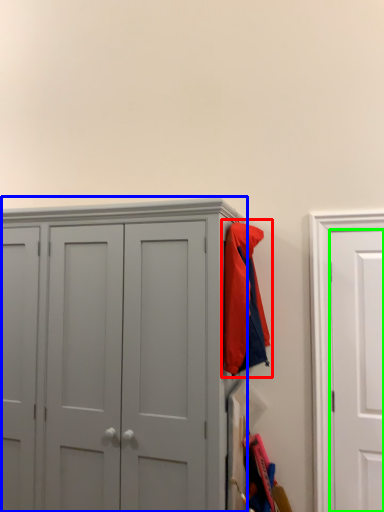
Question: Which is farther away from jacket (highlighted by a red box)? cupboard (highlighted by a blue box) or door (highlighted by a green box)?

Choices:
 (A) cupboard
 (B) door

Answer: (B)